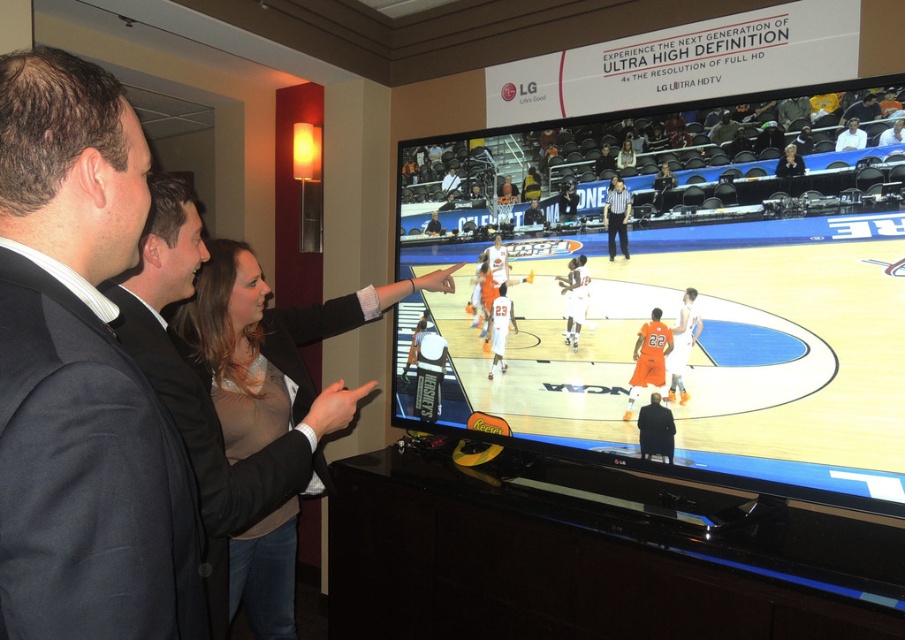
You are standing in the room and see the matte black tv at center and the dark gray suit at upper left. Which object is positioned to the right of the other?

The matte black tv at center is to the right of the dark gray suit at upper left.

You are standing in the room and want to see the matte black tv at center clearly. The black fabric jacket at center is blocking your view. Can you move around to see the TV better?

Yes, you can move around to see the matte black tv at center better because it is in front of the black fabric jacket at center, meaning the jacket is behind the TV and not blocking the view.

You are attending an LG Ultra HD TV event and notice two attendees dressed in formal attire. The dark gray suit at upper left and the matte black blazer at center are both in your line of sight. Which clothing item is closer to the front of the scene?

The dark gray suit at upper left is positioned over the matte black blazer at center, meaning it is closer to the front of the scene.